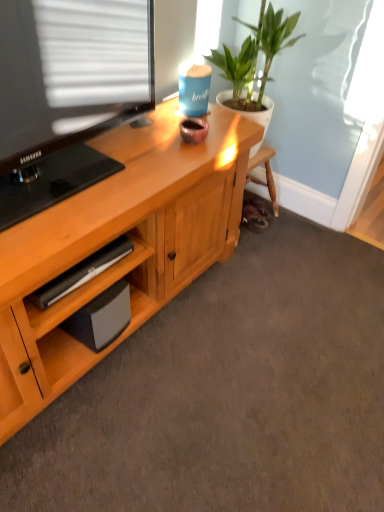
Describe the element at coordinates (256, 59) in the screenshot. The height and width of the screenshot is (512, 384). I see `green leafy plant at upper right` at that location.

Where is `green leafy plant at upper right`? This screenshot has width=384, height=512. green leafy plant at upper right is located at coordinates (256, 59).

At what (x,y) coordinates should I click in order to perform the action: click on black matte speaker at lower left. Please return your answer as a coordinate pair (x, y). Looking at the image, I should click on (101, 318).

What do you see at coordinates (101, 318) in the screenshot? This screenshot has height=512, width=384. I see `black matte speaker at lower left` at bounding box center [101, 318].

You are a GUI agent. You are given a task and a screenshot of the screen. Output one action in this format:
    pyautogui.click(x=<x>, y=<y>)
    Task: Click on the green leafy plant at upper right
    
    Given the screenshot: What is the action you would take?
    (x=256, y=59)

From the picture: Can you confirm if black matte speaker at lower left is positioned to the right of green leafy plant at upper right?

No, black matte speaker at lower left is not to the right of green leafy plant at upper right.

Does black matte speaker at lower left come in front of green leafy plant at upper right?

Yes, black matte speaker at lower left is in front of green leafy plant at upper right.

Considering the positions of point (98, 306) and point (220, 63), is point (98, 306) closer or farther from the camera than point (220, 63)?

Point (98, 306).

From the image's perspective, would you say black matte speaker at lower left is shown under green leafy plant at upper right?

Yes, from the image's perspective, black matte speaker at lower left is below green leafy plant at upper right.

From a real-world perspective, who is located lower, black matte speaker at lower left or green leafy plant at upper right?

black matte speaker at lower left is physically lower.

Considering the sizes of black matte speaker at lower left and green leafy plant at upper right in the image, is black matte speaker at lower left wider or thinner than green leafy plant at upper right?

black matte speaker at lower left is thinner than green leafy plant at upper right.

Considering the relative sizes of black matte speaker at lower left and green leafy plant at upper right in the image provided, is black matte speaker at lower left shorter than green leafy plant at upper right?

Yes, black matte speaker at lower left is shorter than green leafy plant at upper right.

Which of these two, black matte speaker at lower left or green leafy plant at upper right, is bigger?

green leafy plant at upper right is bigger.

Is black matte speaker at lower left spatially inside green leafy plant at upper right, or outside of it?

black matte speaker at lower left is not inside green leafy plant at upper right, it's outside.

Is there a large distance between black matte speaker at lower left and green leafy plant at upper right?

No, black matte speaker at lower left is not far away from green leafy plant at upper right.

Is black matte speaker at lower left oriented towards green leafy plant at upper right?

No, black matte speaker at lower left is not facing towards green leafy plant at upper right.

Can you tell me how much black matte speaker at lower left and green leafy plant at upper right differ in facing direction?

1.71 degrees separate the facing orientations of black matte speaker at lower left and green leafy plant at upper right.

Find the location of a particular element. The width and height of the screenshot is (384, 512). speaker in front of the green leafy plant at upper right is located at coordinates (101, 318).

Does green leafy plant at upper right appear on the left side of black matte speaker at lower left?

In fact, green leafy plant at upper right is to the right of black matte speaker at lower left.

Is green leafy plant at upper right positioned behind black matte speaker at lower left?

Yes, green leafy plant at upper right is further from the viewer.

Between point (240, 21) and point (115, 284), which one is positioned in front?

Positioned in front is point (115, 284).

From the image's perspective, is green leafy plant at upper right below black matte speaker at lower left?

No, from the image's perspective, green leafy plant at upper right is not below black matte speaker at lower left.

From a real-world perspective, is green leafy plant at upper right under black matte speaker at lower left?

No.

Which object is wider, green leafy plant at upper right or black matte speaker at lower left?

green leafy plant at upper right.

Between green leafy plant at upper right and black matte speaker at lower left, which one has less height?

Standing shorter between the two is black matte speaker at lower left.

Considering the sizes of objects green leafy plant at upper right and black matte speaker at lower left in the image provided, who is smaller, green leafy plant at upper right or black matte speaker at lower left?

black matte speaker at lower left is smaller.

Is green leafy plant at upper right not within black matte speaker at lower left?

Indeed, green leafy plant at upper right is completely outside black matte speaker at lower left.

Are green leafy plant at upper right and black matte speaker at lower left located far from each other?

No, green leafy plant at upper right is not far from black matte speaker at lower left.

Could you tell me if green leafy plant at upper right is facing black matte speaker at lower left?

No, green leafy plant at upper right is not oriented towards black matte speaker at lower left.

How different are the orientations of green leafy plant at upper right and black matte speaker at lower left in degrees?

Result: The angular difference between green leafy plant at upper right and black matte speaker at lower left is 1.71 degrees.

The image size is (384, 512). What are the coordinates of `speaker lying on the left of green leafy plant at upper right` in the screenshot? It's located at (101, 318).

Identify the location of houseplant above the black matte speaker at lower left (from the image's perspective). (256, 59).

At what (x,y) coordinates should I click in order to perform the action: click on speaker located below the green leafy plant at upper right (from the image's perspective). Please return your answer as a coordinate pair (x, y). The width and height of the screenshot is (384, 512). Looking at the image, I should click on (101, 318).